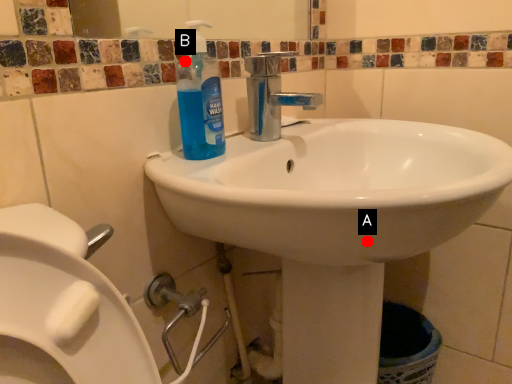
Question: Two points are circled on the image, labeled by A and B beside each circle. Which point is closer to the camera?

Choices:
 (A) A is closer
 (B) B is closer

Answer: (A)